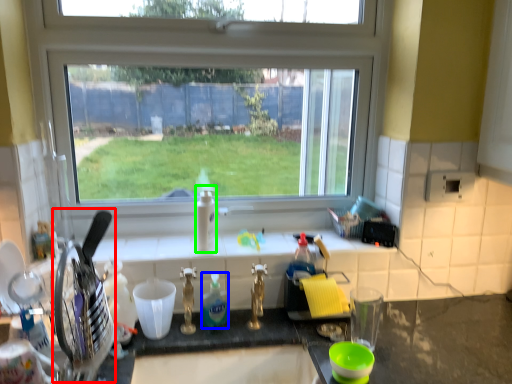
Question: Which is farther away from appliance (highlighted by a red box)? bottle (highlighted by a blue box) or bottle (highlighted by a green box)?

Choices:
 (A) bottle
 (B) bottle

Answer: (B)